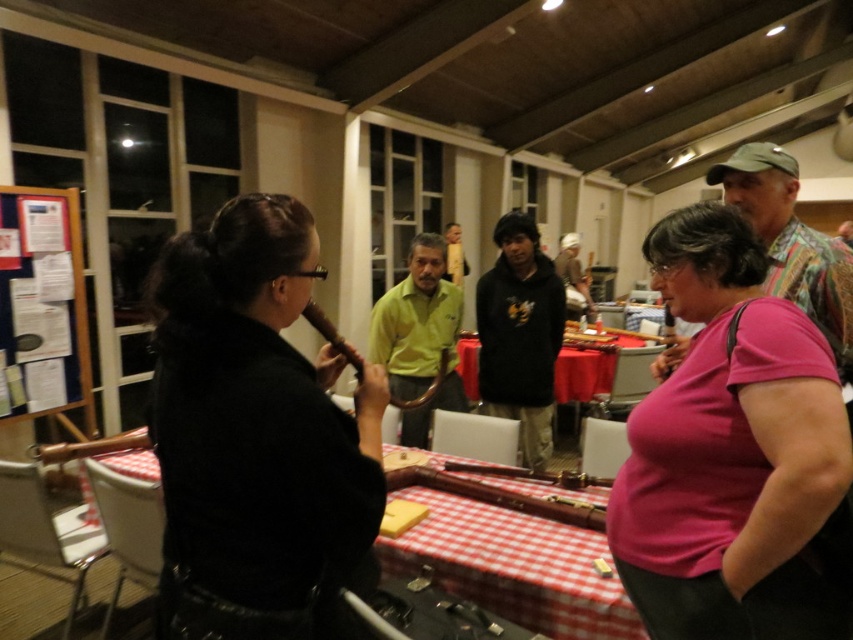
You are attending a social gathering and see the red checkered tablecloth at center and the black hoodie at center. Which object is positioned higher from the ground?

The black hoodie at center is positioned higher from the ground than the red checkered tablecloth at center because the red checkered tablecloth at center is below the black hoodie at center.

You are a guest at this event and want to place a small plate of snacks on the table. Which object, the red checkered tablecloth at center or the black hoodie at center, is the correct surface to place the snacks?

The red checkered tablecloth at center is the correct surface to place the snacks because it has a lesser height compared to the black hoodie at center, indicating it is the table itself.